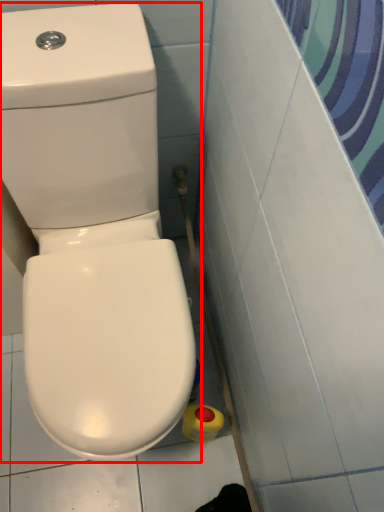
Question: From the image's perspective, where is toilet (annotated by the red box) located in relation to cleaning product in the image?

Choices:
 (A) below
 (B) above

Answer: (B)